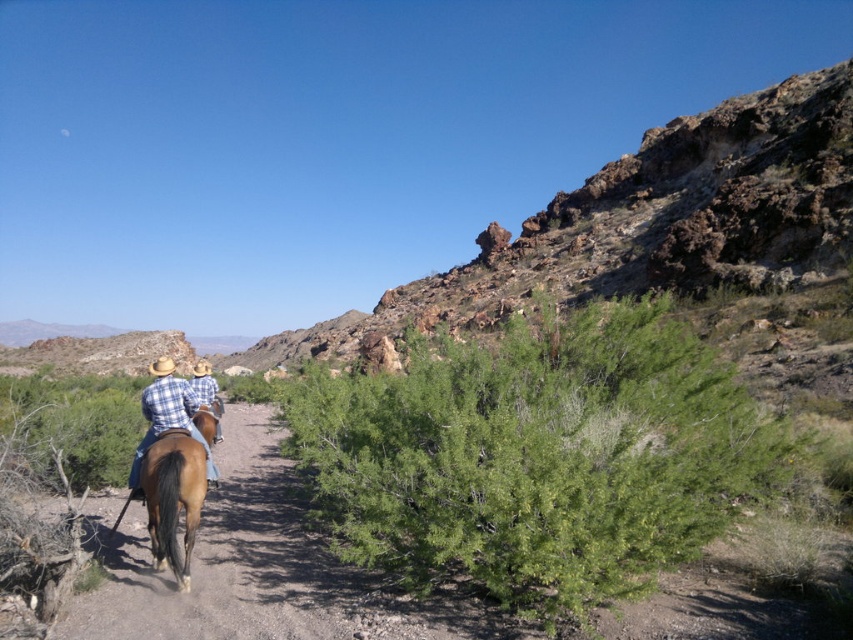
Question: Which of the following is the closest to the observer?

Choices:
 (A) click(x=486, y=342)
 (B) click(x=219, y=424)

Answer: (B)

Question: Which point is farther to the camera?

Choices:
 (A) (170, 428)
 (B) (537, 588)

Answer: (A)

Question: Which object is the closest to the plaid fabric shirt at center-left?

Choices:
 (A) green leafy bush at center
 (B) blue plaid shirt at center
 (C) brown glossy horse at center

Answer: (C)

Question: From the image, what is the correct spatial relationship of plaid fabric shirt at center-left in relation to blue plaid shirt at center?

Choices:
 (A) below
 (B) above

Answer: (B)

Question: Does brown glossy horse at center have a lesser width compared to blue plaid shirt at center?

Choices:
 (A) no
 (B) yes

Answer: (B)

Question: Can you confirm if plaid fabric shirt at center-left is positioned below blue plaid shirt at center?

Choices:
 (A) yes
 (B) no

Answer: (B)